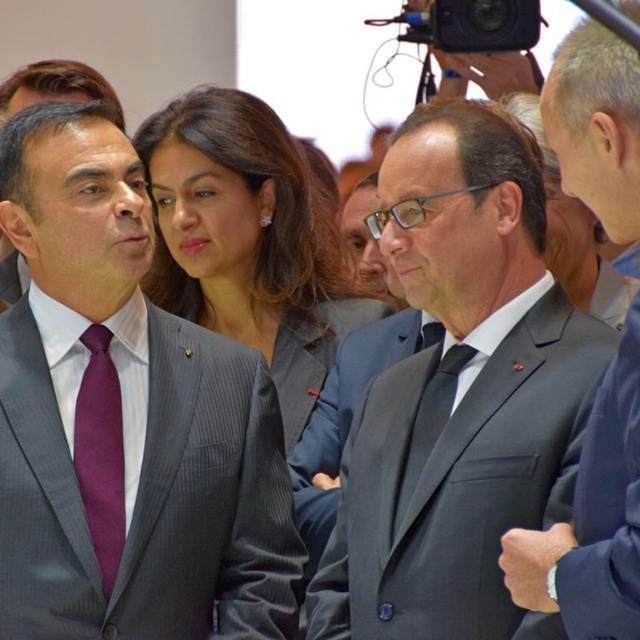
Is matte gray suit at center shorter than purple satin tie at left?

Incorrect, matte gray suit at center's height does not fall short of purple satin tie at left's.

At what (x,y) coordinates should I click in order to perform the action: click on matte gray suit at center. Please return your answer as a coordinate pair (x, y). Looking at the image, I should click on (460, 392).

Locate an element on the screen. matte gray suit at center is located at coordinates (460, 392).

Is purple tie at left closer to camera compared to matte gray suit at center?

No, purple tie at left is further to the viewer.

Between point (74, 116) and point (476, 234), which one is positioned behind?

Positioned behind is point (74, 116).

You are a GUI agent. You are given a task and a screenshot of the screen. Output one action in this format:
    pyautogui.click(x=<x>, y=<y>)
    Task: Click on the purple tie at left
    This screenshot has height=640, width=640.
    Given the screenshot: What is the action you would take?
    pyautogui.click(x=125, y=420)

What do you see at coordinates (125, 420) in the screenshot?
I see `purple tie at left` at bounding box center [125, 420].

Is point (264, 554) farther from viewer compared to point (122, 548)?

That is True.

At what (x,y) coordinates should I click in order to perform the action: click on purple tie at left. Please return your answer as a coordinate pair (x, y). Looking at the image, I should click on (125, 420).